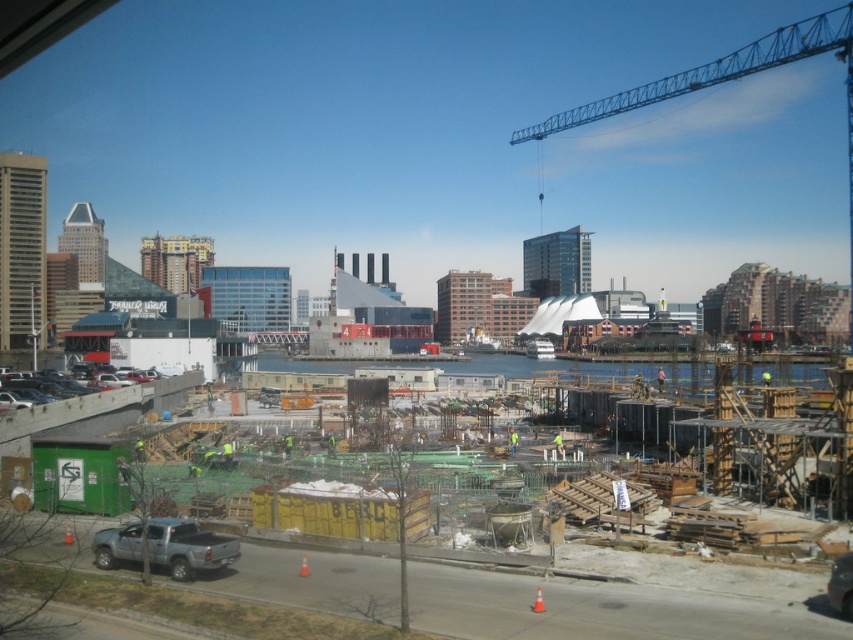
Question: Which object is positioned farthest from the green reflective safety vest at center?

Choices:
 (A) silver metallic truck at lower left
 (B) matte gray car at lower left

Answer: (B)

Question: Can you confirm if yellowish-green wood at center is smaller than silver metallic truck at lower left?

Choices:
 (A) no
 (B) yes

Answer: (A)

Question: Does blue metallic crane at upper right have a smaller size compared to matte gray car at lower left?

Choices:
 (A) no
 (B) yes

Answer: (A)

Question: Among these points, which one is nearest to the camera?

Choices:
 (A) (517, 442)
 (B) (474, 616)
 (C) (114, 536)
 (D) (39, 372)

Answer: (B)

Question: Does silver metallic truck at lower left appear over green reflective safety vest at center?

Choices:
 (A) no
 (B) yes

Answer: (A)

Question: Estimate the real-world distances between objects in this image. Which object is closer to the blue metallic crane at upper right?

Choices:
 (A) yellowish-green wood at center
 (B) silver metallic truck at lower left
 (C) matte gray car at lower left
 (D) green reflective safety vest at center

Answer: (A)